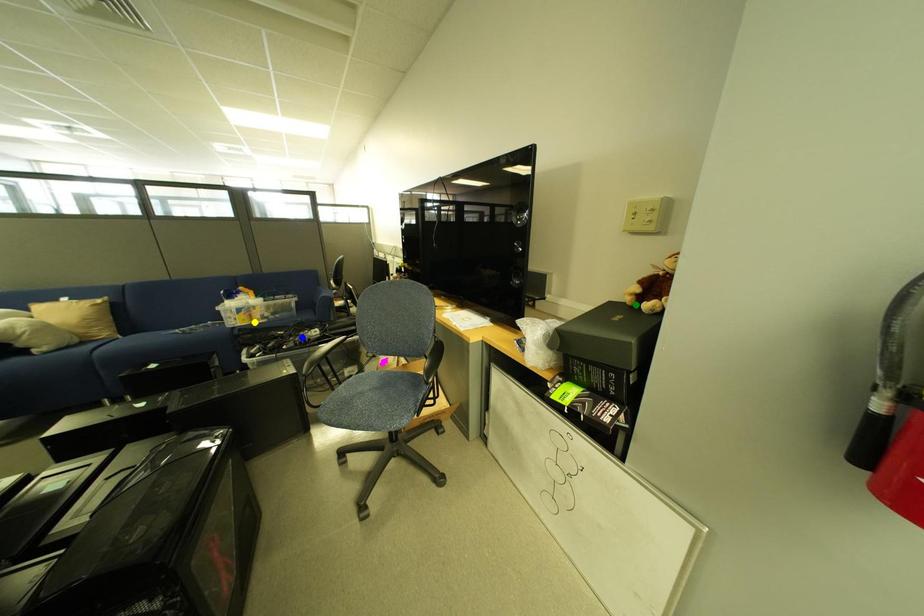
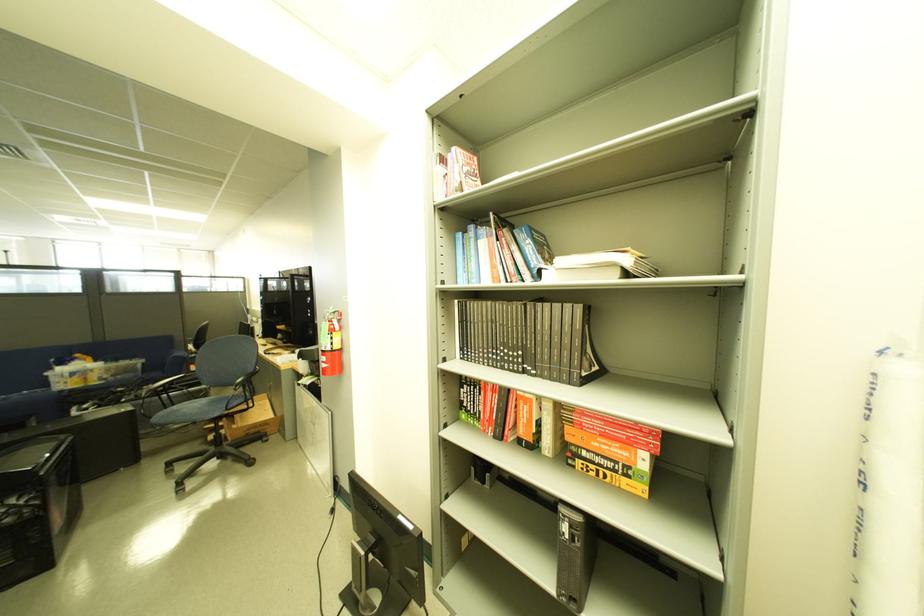
I am providing you with two images of the same scene from different viewpoints. Three points are marked in image1. Which point corresponds to a part or object that is occluded in image2?In image1, three points are marked. Which of them correspond to a part or object that is occluded in image2?Among the three points shown in image1, which one corresponds to a part or object that is no longer visible due to occlusion in image2?

green point